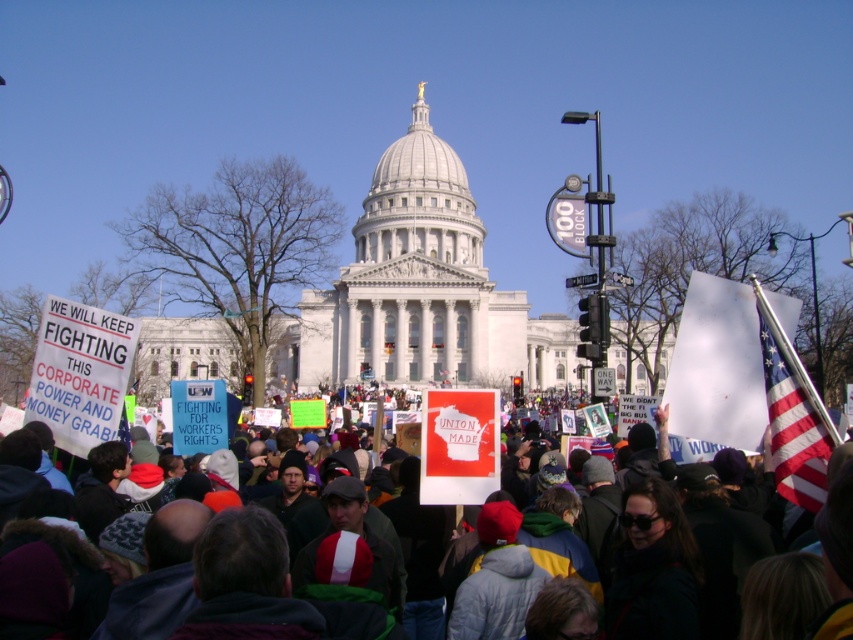
Which is below, white paper sign at center or american flag at right?

white paper sign at center

Which is above, white paper sign at center or american flag at right?

american flag at right

Does point (840, 540) come closer to viewer compared to point (782, 490)?

Yes, point (840, 540) is closer to viewer.

Find the location of a particular element. The image size is (853, 640). white paper sign at center is located at coordinates (689, 566).